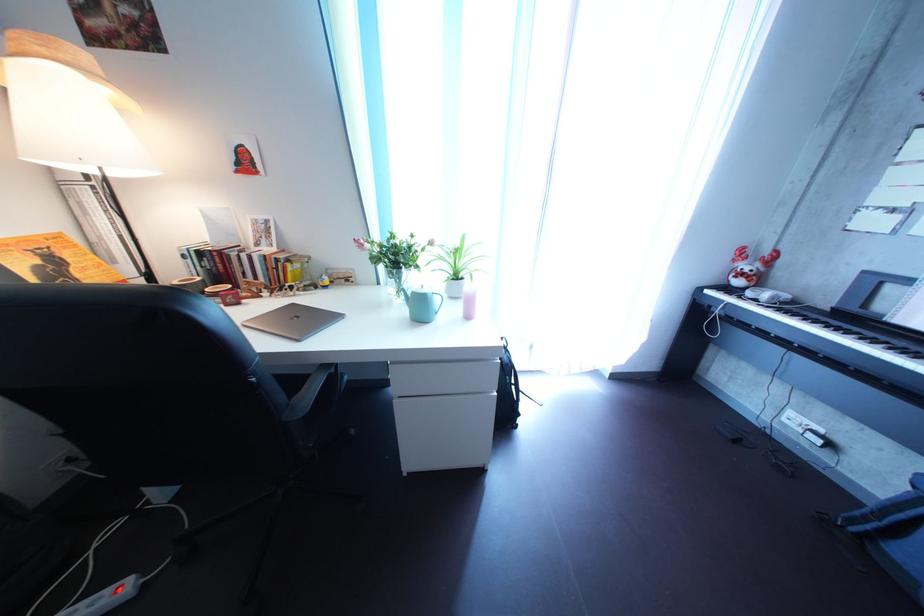
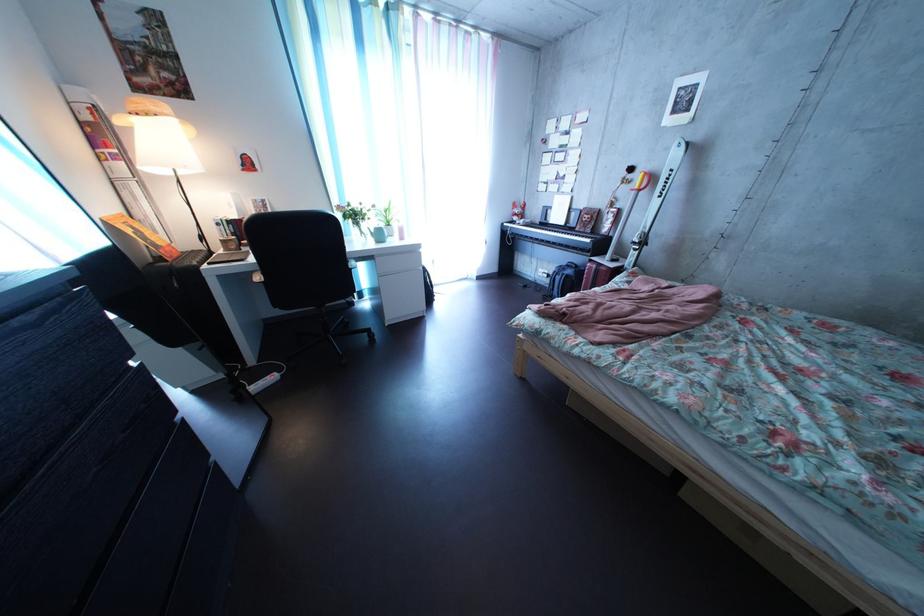
Find the pixel in the second image that matches the point at 37,273 in the first image.

(142, 238)